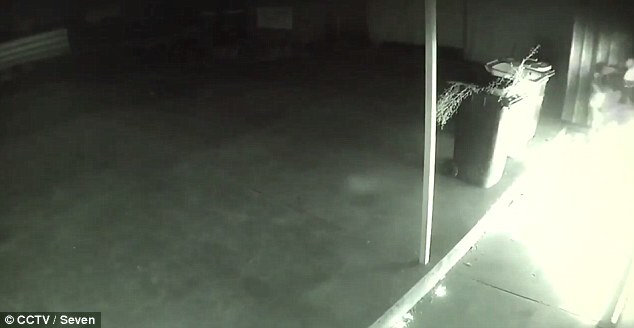
The image size is (634, 328). I want to click on door, so click(610, 35).